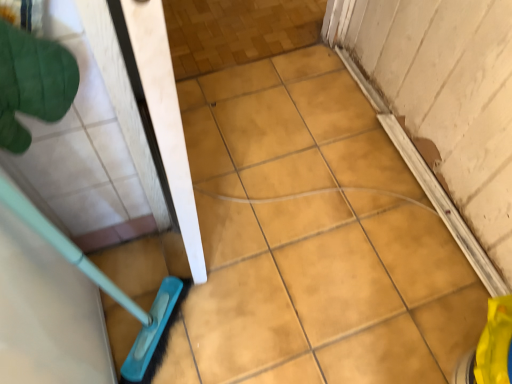
Question: From the image's perspective, would you say yellow matte tile at center, placed as the second ceramic tile when sorted from right to left, is shown under yellow matte tile at lower right, the first ceramic tile in the right-to-left sequence?

Choices:
 (A) yes
 (B) no

Answer: (B)

Question: Does yellow matte tile at center, placed as the second ceramic tile when sorted from right to left, have a greater height compared to yellow matte tile at lower right, the first ceramic tile in the right-to-left sequence?

Choices:
 (A) yes
 (B) no

Answer: (B)

Question: Considering the relative sizes of yellow matte tile at center, placed as the second ceramic tile when sorted from right to left, and yellow matte tile at lower right, which appears as the 2th ceramic tile when viewed from the left, in the image provided, is yellow matte tile at center, placed as the second ceramic tile when sorted from right to left, bigger than yellow matte tile at lower right, which appears as the 2th ceramic tile when viewed from the left,?

Choices:
 (A) yes
 (B) no

Answer: (A)

Question: From a real-world perspective, is yellow matte tile at center, placed as the second ceramic tile when sorted from right to left, below yellow matte tile at lower right, the first ceramic tile in the right-to-left sequence?

Choices:
 (A) yes
 (B) no

Answer: (A)

Question: Is yellow matte tile at center, which is counted as the 1th ceramic tile, starting from the left, located outside yellow matte tile at lower right, the first ceramic tile in the right-to-left sequence?

Choices:
 (A) yes
 (B) no

Answer: (A)

Question: Is yellow matte tile at lower right, the first ceramic tile in the right-to-left sequence, a part of yellow matte tile at center, which is counted as the 1th ceramic tile, starting from the left?

Choices:
 (A) yes
 (B) no

Answer: (B)

Question: Is green fabric glove at upper left in front of yellow matte tile at lower right, the first ceramic tile in the right-to-left sequence?

Choices:
 (A) yes
 (B) no

Answer: (A)

Question: Considering the relative sizes of green fabric glove at upper left and yellow matte tile at lower right, the first ceramic tile in the right-to-left sequence, in the image provided, is green fabric glove at upper left taller than yellow matte tile at lower right, the first ceramic tile in the right-to-left sequence,?

Choices:
 (A) yes
 (B) no

Answer: (B)

Question: Is yellow matte tile at lower right, the first ceramic tile in the right-to-left sequence, located within green fabric glove at upper left?

Choices:
 (A) yes
 (B) no

Answer: (B)

Question: Does green fabric glove at upper left appear on the right side of yellow matte tile at lower right, which appears as the 2th ceramic tile when viewed from the left?

Choices:
 (A) no
 (B) yes

Answer: (A)

Question: Is yellow matte tile at lower right, which appears as the 2th ceramic tile when viewed from the left, at the back of green fabric glove at upper left?

Choices:
 (A) no
 (B) yes

Answer: (A)

Question: Is green fabric glove at upper left facing towards yellow matte tile at lower right, which appears as the 2th ceramic tile when viewed from the left?

Choices:
 (A) yes
 (B) no

Answer: (B)

Question: Considering the relative sizes of yellow matte tile at lower right, which appears as the 2th ceramic tile when viewed from the left, and green fabric glove at upper left in the image provided, is yellow matte tile at lower right, which appears as the 2th ceramic tile when viewed from the left, shorter than green fabric glove at upper left?

Choices:
 (A) no
 (B) yes

Answer: (A)